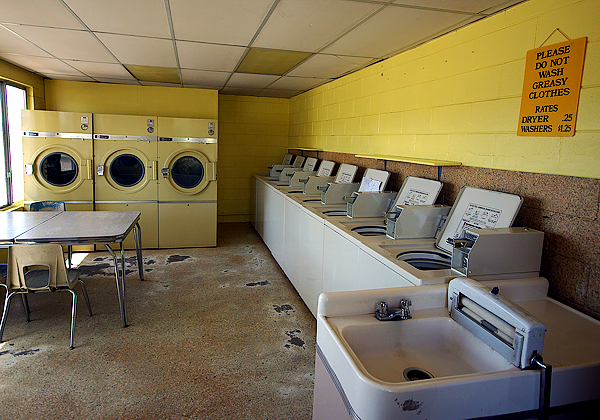
Identify the location of handle. Image resolution: width=600 pixels, height=420 pixels. (378, 304).